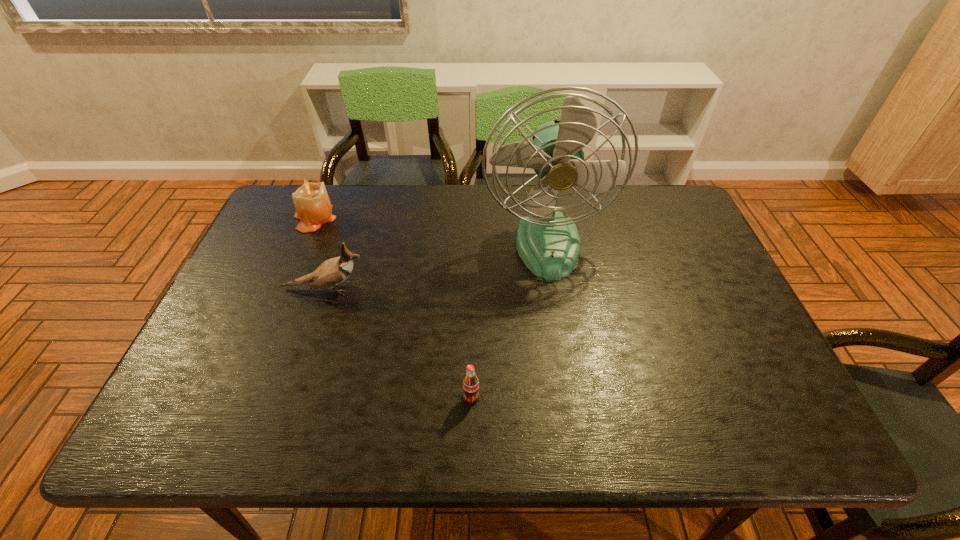
In order to click on vacant space that's between the candle and the bird in this screenshot , I will do `click(320, 253)`.

Select which object appears as the closest to the candle. Please provide its 2D coordinates. Your answer should be formatted as a tuple, i.e. [(x, y)], where the tuple contains the x and y coordinates of a point satisfying the conditions above.

[(333, 271)]

Locate an element on the screen. object that can be found as the second closest to the bird is located at coordinates [x=548, y=242].

The height and width of the screenshot is (540, 960). I want to click on free spot that satisfies the following two spatial constraints: 1. in front of the fan, directing airflow; 2. at the face of the bird, so click(x=554, y=288).

Image resolution: width=960 pixels, height=540 pixels. I want to click on free space that satisfies the following two spatial constraints: 1. on the front side of the shortest object; 2. on the left side of the candle, so click(x=240, y=397).

At what (x,y) coordinates should I click in order to perform the action: click on vacant area in the image that satisfies the following two spatial constraints: 1. in front of the tallest object, directing airflow; 2. at the face of the bird. Please return your answer as a coordinate pair (x, y). This screenshot has height=540, width=960. Looking at the image, I should click on (554, 288).